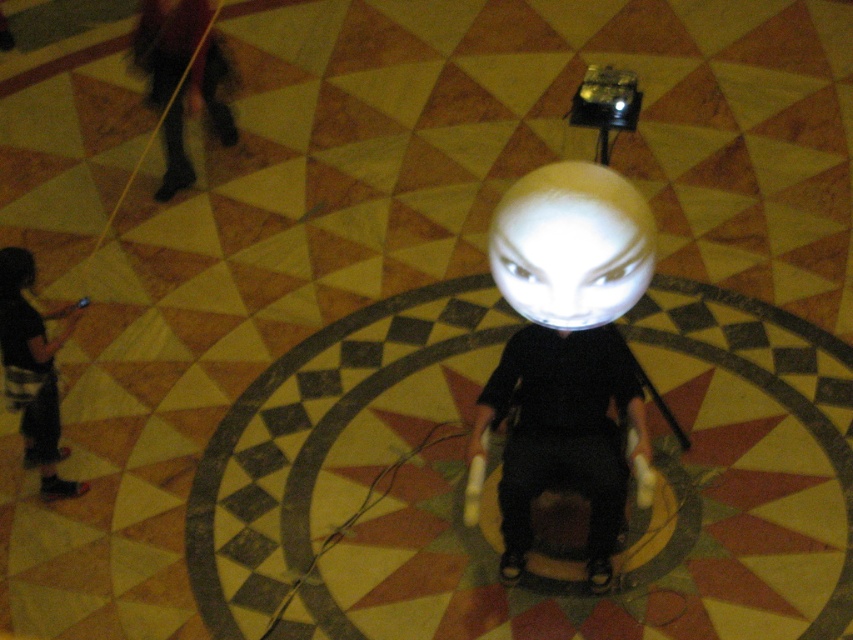
Question: Can you confirm if white glossy sphere at center is thinner than black matte hair at lower left?

Choices:
 (A) no
 (B) yes

Answer: (A)

Question: Which object appears closest to the camera in this image?

Choices:
 (A) white glossy sphere at center
 (B) black matte hair at lower left

Answer: (A)

Question: In this image, where is white glossy sphere at center located relative to black matte hair at lower left?

Choices:
 (A) left
 (B) right

Answer: (B)

Question: Which of the following is the farthest from the observer?

Choices:
 (A) black matte hair at lower left
 (B) white glossy sphere at center

Answer: (A)

Question: Which point is closer to the camera taking this photo?

Choices:
 (A) (22, 257)
 (B) (648, 230)

Answer: (B)

Question: Considering the relative positions of white glossy sphere at center and black matte hair at lower left in the image provided, where is white glossy sphere at center located with respect to black matte hair at lower left?

Choices:
 (A) below
 (B) above

Answer: (A)